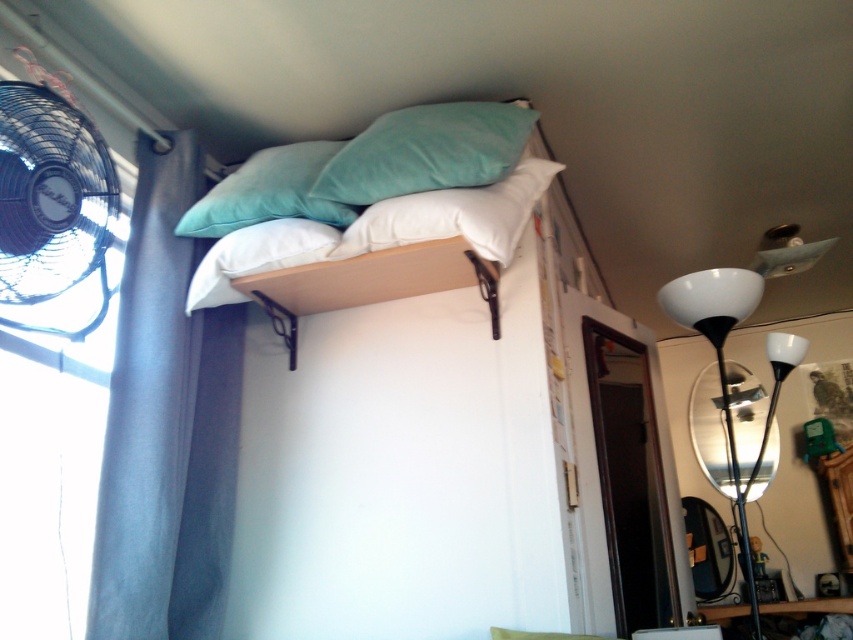
Question: Where is soft cotton pillows at upper center located in relation to teal soft pillow at upper center in the image?

Choices:
 (A) below
 (B) above

Answer: (A)

Question: Does blue fabric curtain at left appear on the left side of white soft pillow at center?

Choices:
 (A) yes
 (B) no

Answer: (A)

Question: Which object appears closest to the camera in this image?

Choices:
 (A) soft cotton pillows at upper center
 (B) black plastic fan at left

Answer: (B)

Question: Estimate the real-world distances between objects in this image. Which object is closer to the black plastic fan at left?

Choices:
 (A) blue fabric curtain at left
 (B) teal soft pillow at upper center

Answer: (A)

Question: Which is farther from the blue fabric curtain at left?

Choices:
 (A) soft white pillow at center
 (B) black plastic fan at left
 (C) white glossy floor lamp at right

Answer: (C)

Question: Can you confirm if blue fabric curtain at left is smaller than soft cotton pillows at upper center?

Choices:
 (A) no
 (B) yes

Answer: (B)